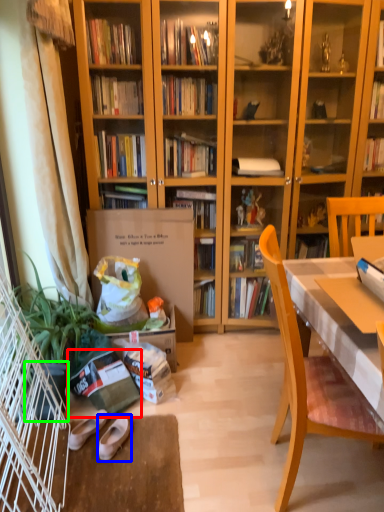
Question: Which is farther away from paperback book (highlighted by a red box)? footwear (highlighted by a blue box) or flowerpot (highlighted by a green box)?

Choices:
 (A) footwear
 (B) flowerpot

Answer: (A)